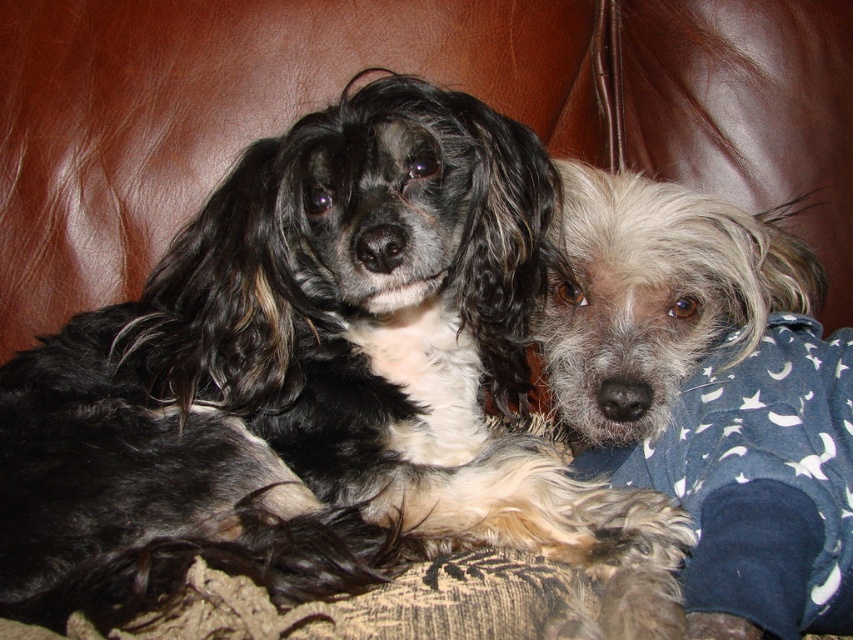
Question: Can you confirm if black silky fur dog at center is positioned above gray fluffy dog at center?

Choices:
 (A) yes
 (B) no

Answer: (B)

Question: Which point is farther to the camera?

Choices:
 (A) (312, 596)
 (B) (671, 346)

Answer: (B)

Question: Does black silky fur dog at center appear on the right side of gray fluffy dog at center?

Choices:
 (A) no
 (B) yes

Answer: (A)

Question: Can you confirm if black silky fur dog at center is smaller than gray fluffy dog at center?

Choices:
 (A) no
 (B) yes

Answer: (A)